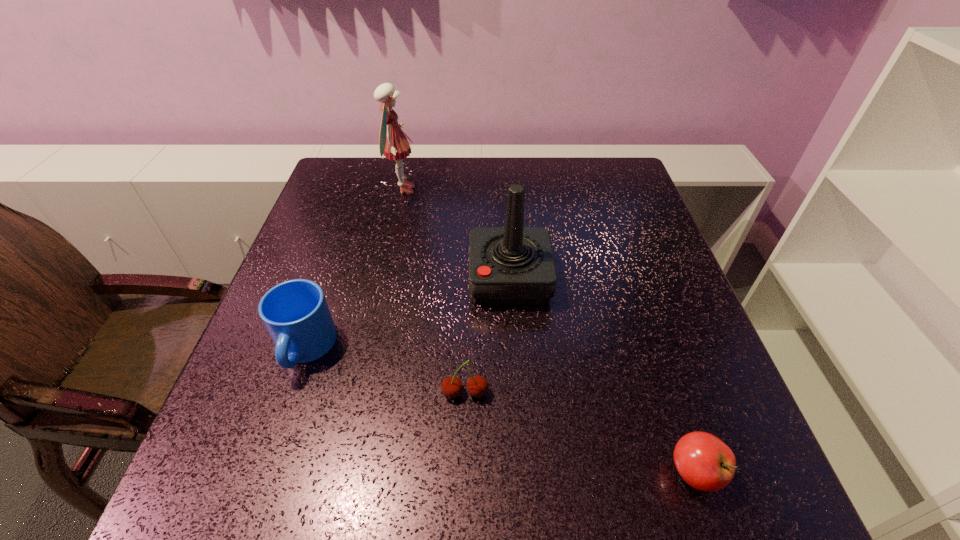
I want to click on vacant area that lies between the nearest object and the mug, so click(x=500, y=410).

I want to click on vacant space that is in between the cherry and the second object from left to right, so click(x=434, y=292).

At what (x,y) coordinates should I click in order to perform the action: click on unoccupied position between the second tallest object and the mug. Please return your answer as a coordinate pair (x, y). Looking at the image, I should click on (407, 314).

Identify the location of free space between the apple and the mug. (500, 410).

Locate an element on the screen. The width and height of the screenshot is (960, 540). unoccupied position between the fourth nearest object and the cherry is located at coordinates (488, 336).

This screenshot has width=960, height=540. In order to click on unoccupied area between the joystick and the mug in this screenshot , I will do `click(407, 314)`.

At what (x,y) coordinates should I click in order to perform the action: click on free area in between the cherry and the fourth object from right to left. Please return your answer as a coordinate pair (x, y). The width and height of the screenshot is (960, 540). Looking at the image, I should click on (434, 292).

Point out which object is positioned as the second nearest to the cherry. Please provide its 2D coordinates. Your answer should be formatted as a tuple, i.e. [(x, y)], where the tuple contains the x and y coordinates of a point satisfying the conditions above.

[(295, 313)]

Select which object is the fourth closest to the farthest object. Please provide its 2D coordinates. Your answer should be formatted as a tuple, i.e. [(x, y)], where the tuple contains the x and y coordinates of a point satisfying the conditions above.

[(705, 462)]

The image size is (960, 540). I want to click on vacant space that satisfies the following two spatial constraints: 1. on the surface of the cherry; 2. on the left side of the rightmost object, so click(463, 472).